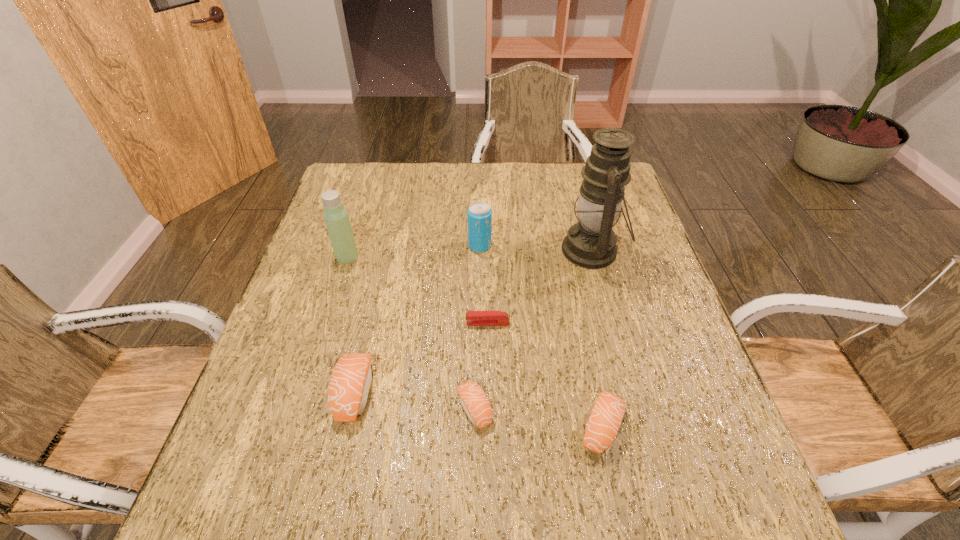
I want to click on vacant space that satisfies the following two spatial constraints: 1. on the front-facing side of the stapler; 2. on the front side of the fourth shortest object, so click(x=489, y=393).

Find the location of a particular element. free region that satisfies the following two spatial constraints: 1. on the front side of the thermos bottle; 2. on the right side of the rightmost sushi is located at coordinates (294, 427).